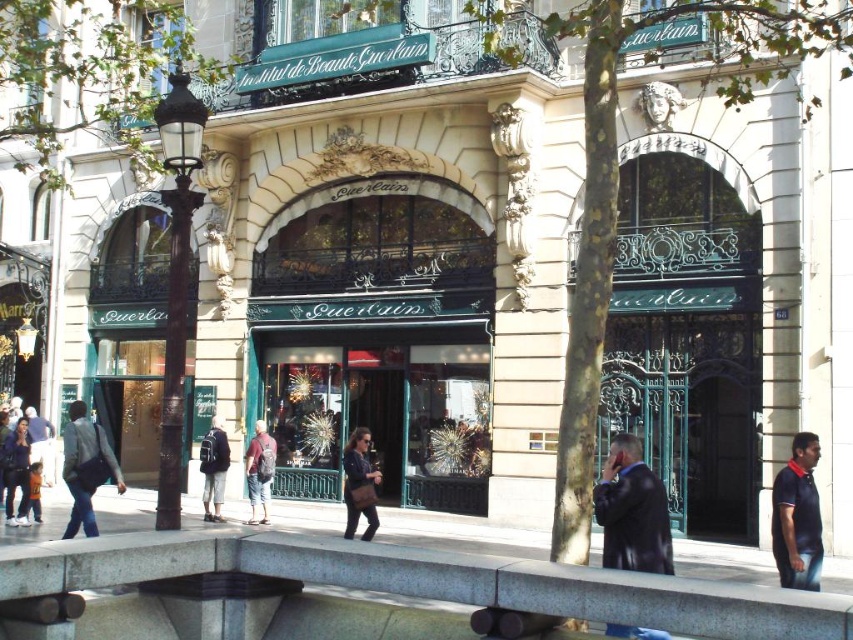
Question: Which point is closer to the camera taking this photo?

Choices:
 (A) (810, 577)
 (B) (33, 454)
 (C) (74, 452)

Answer: (A)

Question: Which point is farther to the camera?

Choices:
 (A) black leather jacket at right
 (B) gray concrete pavement at lower center

Answer: (A)

Question: Considering the relative positions of leather brown bag at center and denim shorts at center in the image provided, where is leather brown bag at center located with respect to denim shorts at center?

Choices:
 (A) above
 (B) below

Answer: (B)

Question: Can you confirm if leather brown bag at center is positioned above denim shorts at center?

Choices:
 (A) no
 (B) yes

Answer: (A)

Question: Can you confirm if black leather jacket at right is positioned to the left of dark blue jeans at lower left?

Choices:
 (A) yes
 (B) no

Answer: (B)

Question: Based on their relative distances, which object is nearer to the denim jacket at lower left?

Choices:
 (A) dark blue polo shirt at lower right
 (B) gray concrete pavement at lower center
 (C) denim shorts at center

Answer: (C)